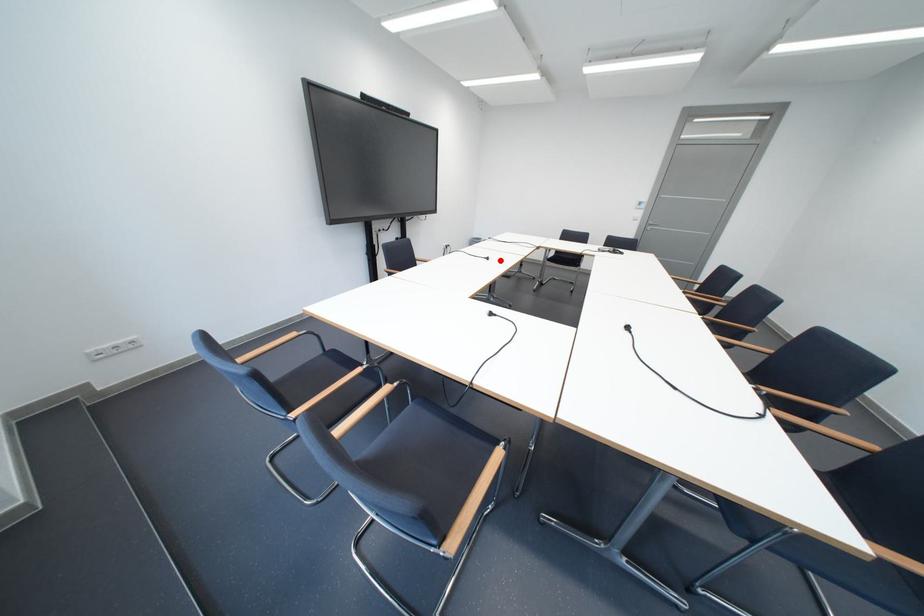
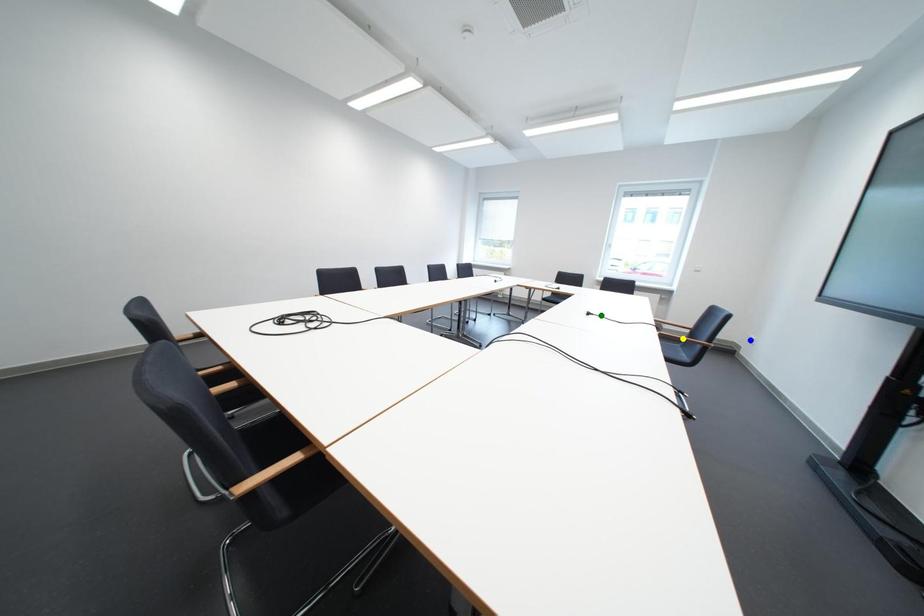
Question: I am providing you with two images of the same scene from different viewpoints. A red point is marked on the first image. You are given multiple points on the second image. In image 2, which mark is for the same physical point as the one in image 1?

Choices:
 (A) green point
 (B) yellow point
 (C) blue point

Answer: (A)